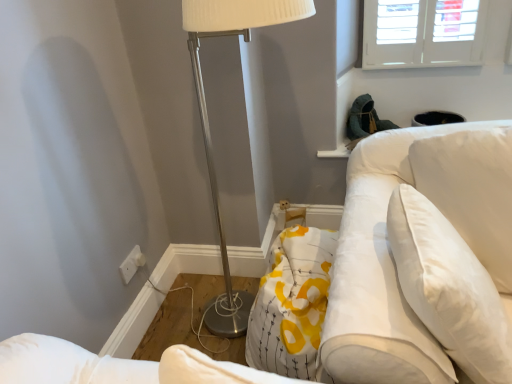
Question: Is white fabric swivel chair at right taller or shorter than metallic silver floor lamp at center?

Choices:
 (A) tall
 (B) short

Answer: (B)

Question: Which is correct: white fabric swivel chair at right is inside metallic silver floor lamp at center, or outside of it?

Choices:
 (A) inside
 (B) outside

Answer: (B)

Question: Considering the real-world distances, which object is farthest from the white soft pillow at upper right?

Choices:
 (A) white plastic electric outlet at lower left
 (B) white fabric swivel chair at right
 (C) metallic silver floor lamp at center

Answer: (A)

Question: Which of these objects is positioned farthest from the white soft pillow at upper right?

Choices:
 (A) metallic silver floor lamp at center
 (B) white fabric swivel chair at right
 (C) white plastic electric outlet at lower left

Answer: (C)